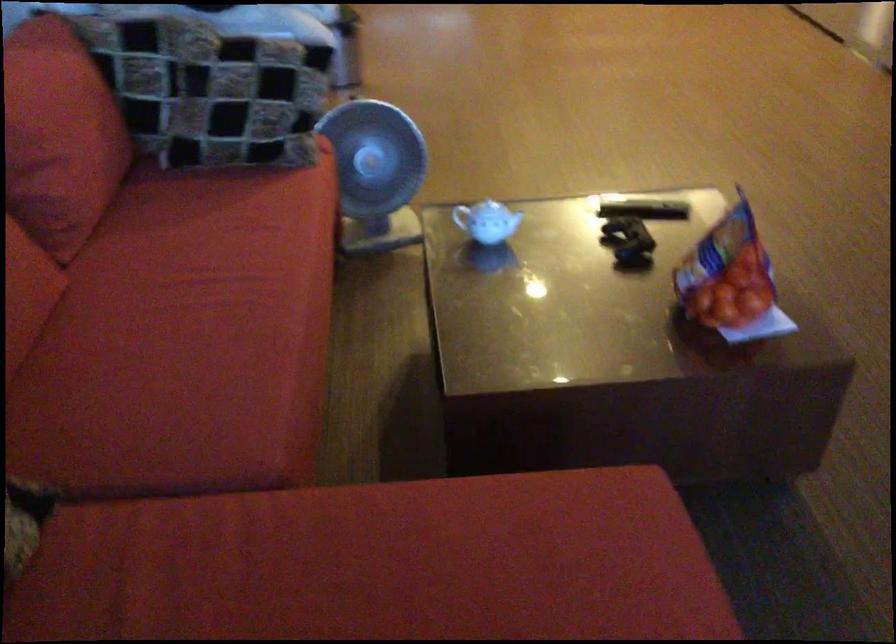
At what (x,y) coordinates should I click in order to perform the action: click on black game controller. Please return your answer as a coordinate pair (x, y). Looking at the image, I should click on (627, 242).